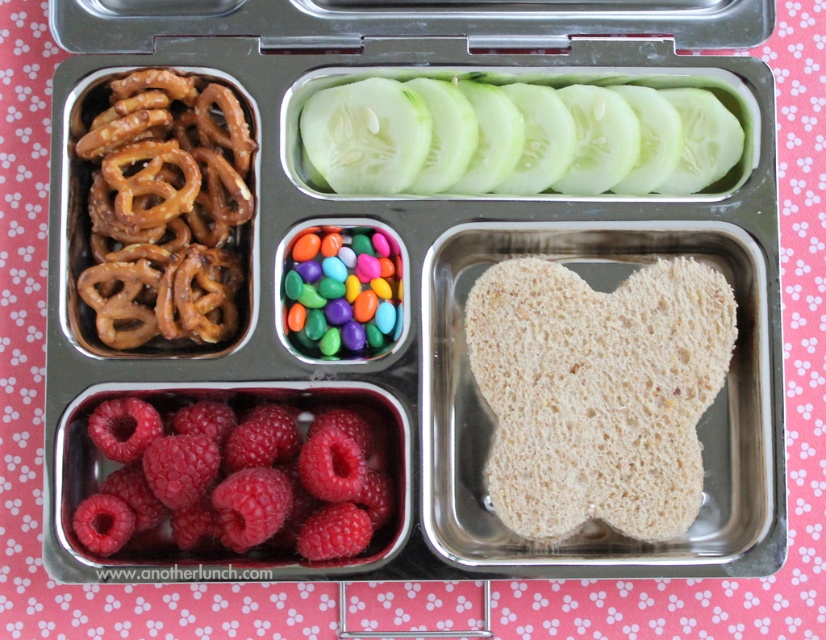
You are a food delivery robot with a 10 inch wide tray. You need to place both the white bread at center and the glossy multicolored candies at center onto your tray. Can you fit both items on your tray without overlapping?

The distance between the white bread at center and the glossy multicolored candies at center is 8.41 inches. Since your tray is 10 inches wide, you can fit both items on the tray without overlapping as there is enough space between them.

You are looking at the bento lunchbox and notice two points marked on it. The first point is at coordinate point [730,161] and the second is at point [95,268]. Which point is closer to you?

Point [730,161] is closer to you than point [95,268] because it is further to the viewer according to the description.